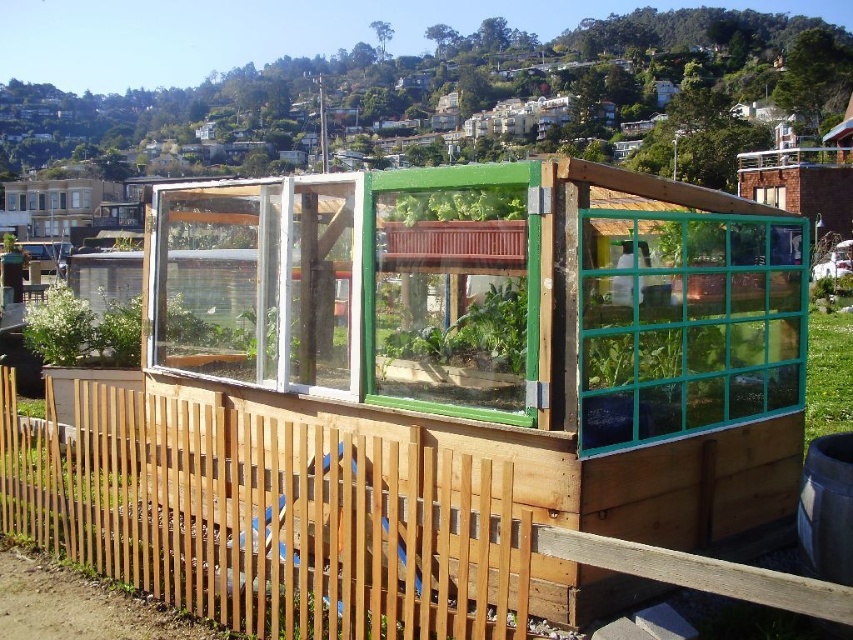
Question: Which of the following is the closest to the observer?

Choices:
 (A) green plastic window at center
 (B) teal glass window at center right

Answer: (B)

Question: Does green plastic window at center appear on the left side of green leafy plant at left?

Choices:
 (A) no
 (B) yes

Answer: (A)

Question: Is brown wooden fence at center positioned in front of teal glass window at center right?

Choices:
 (A) no
 (B) yes

Answer: (B)

Question: Which object appears farthest from the camera in this image?

Choices:
 (A) green leafy plant at left
 (B) brown wooden fence at center

Answer: (A)

Question: Which point is closer to the camera taking this photo?

Choices:
 (A) (743, 300)
 (B) (119, 332)

Answer: (A)

Question: Considering the relative positions of teal glass window at center right and green leafy plant at left in the image provided, where is teal glass window at center right located with respect to green leafy plant at left?

Choices:
 (A) right
 (B) left

Answer: (A)